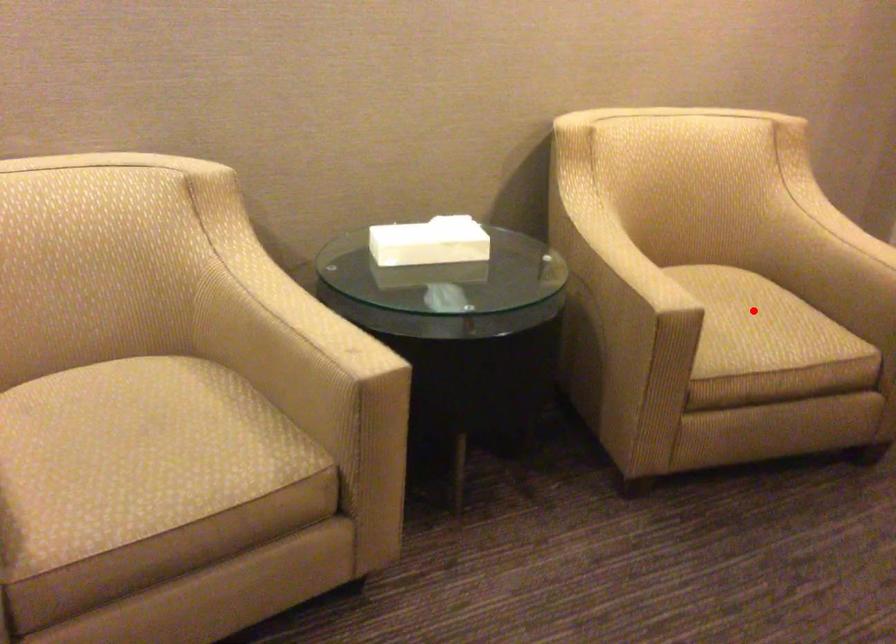
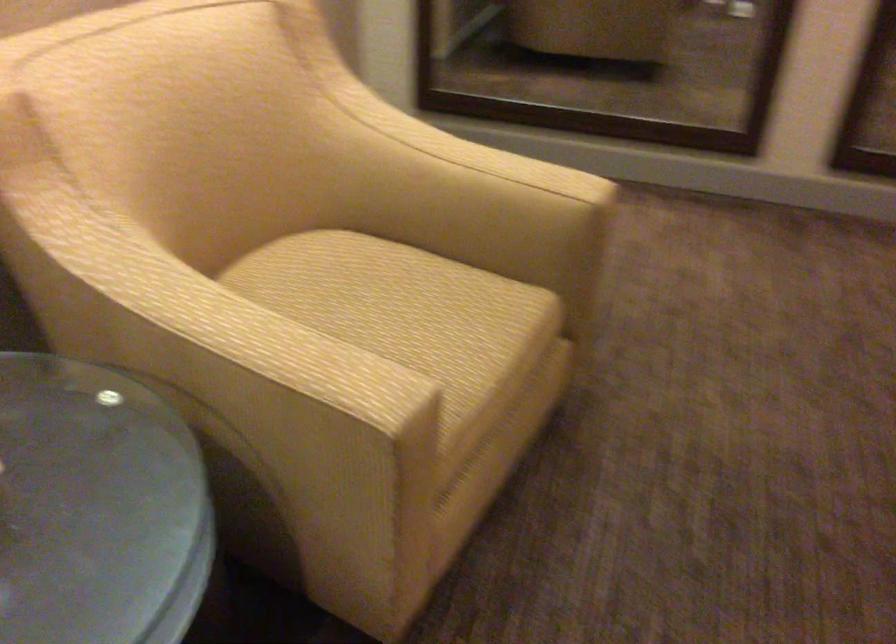
Locate, in the second image, the point that corresponds to the highlighted location in the first image.

(403, 310)